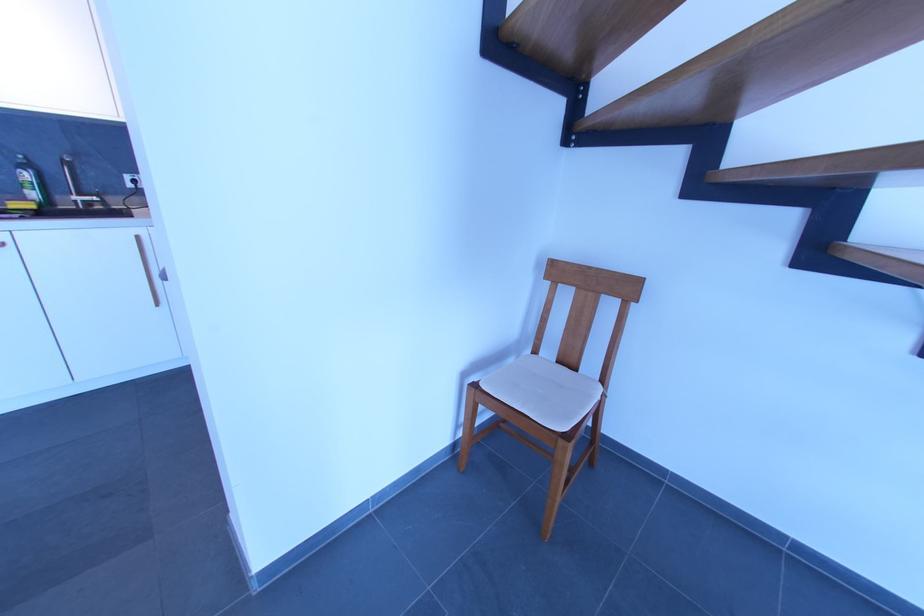
The image size is (924, 616). What do you see at coordinates (543, 391) in the screenshot?
I see `the chair sitting surface` at bounding box center [543, 391].